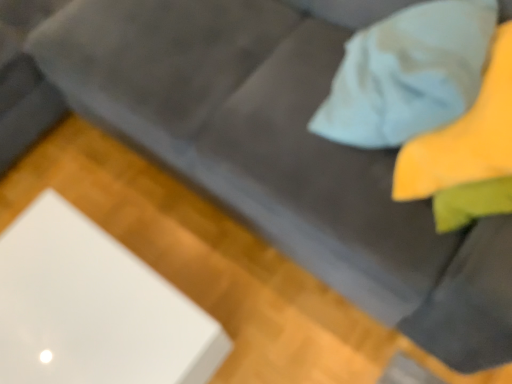
Locate an element on the screen. free space above white glossy cube at lower left (from a real-world perspective) is located at coordinates (69, 309).